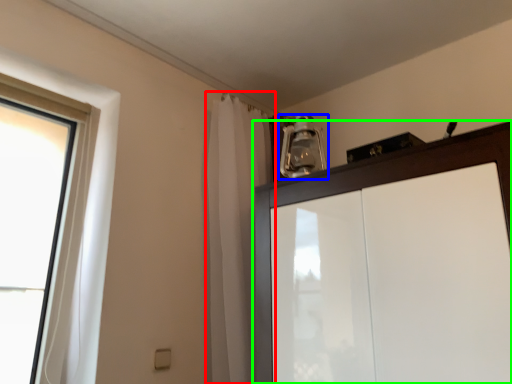
Question: Considering the real-world distances, which object is closest to shower curtain (highlighted by a red box)? light fixture (highlighted by a blue box) or cupboard (highlighted by a green box).

Choices:
 (A) light fixture
 (B) cupboard

Answer: (A)